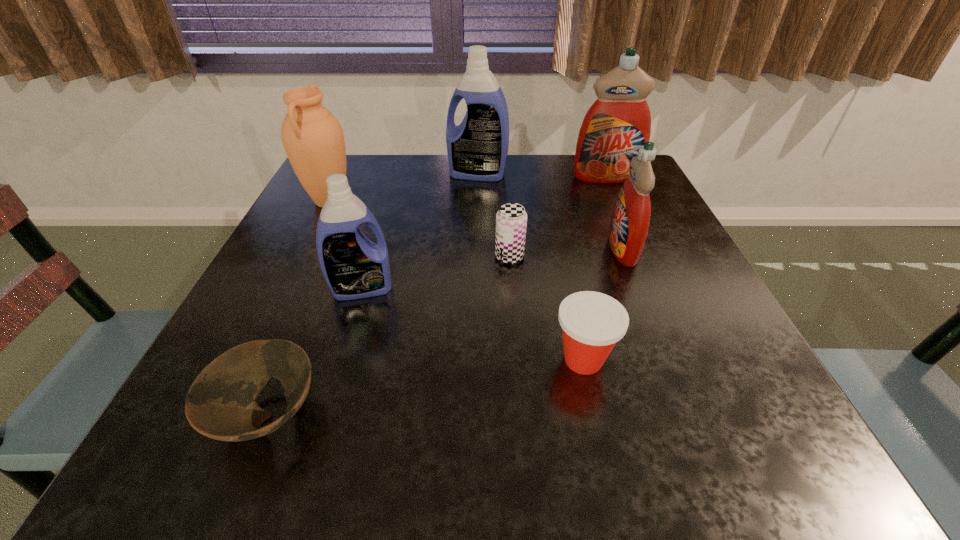
Where is `red-orange Dixie cup`? red-orange Dixie cup is located at coordinates (592, 323).

This screenshot has width=960, height=540. What are the coordinates of `the shortest object` in the screenshot? It's located at (221, 404).

Identify the location of bowl. Image resolution: width=960 pixels, height=540 pixels. (221, 404).

I want to click on vacant point located on the left of the bigger blue detergent, so click(381, 174).

I want to click on free point located on the front surface of the bigger red detergent, so click(635, 243).

At what (x,y) coordinates should I click in order to perform the action: click on vacant space located 0.120m on the right of the third farthest object. Please return your answer as a coordinate pair (x, y). The image size is (960, 540). Looking at the image, I should click on (407, 201).

Where is `vacant space positioned 0.280m on the front surface of the third farthest detergent`? The height and width of the screenshot is (540, 960). vacant space positioned 0.280m on the front surface of the third farthest detergent is located at coordinates (469, 249).

I want to click on vacant space located 0.380m on the front surface of the third farthest detergent, so click(420, 249).

The width and height of the screenshot is (960, 540). What are the coordinates of `free space located 0.320m on the front surface of the third farthest detergent` in the screenshot? It's located at (450, 249).

At what (x,y) coordinates should I click in order to perform the action: click on vacant position located 0.390m on the back of the nearer blue detergent. Please return your answer as a coordinate pair (x, y). Looking at the image, I should click on point(396,176).